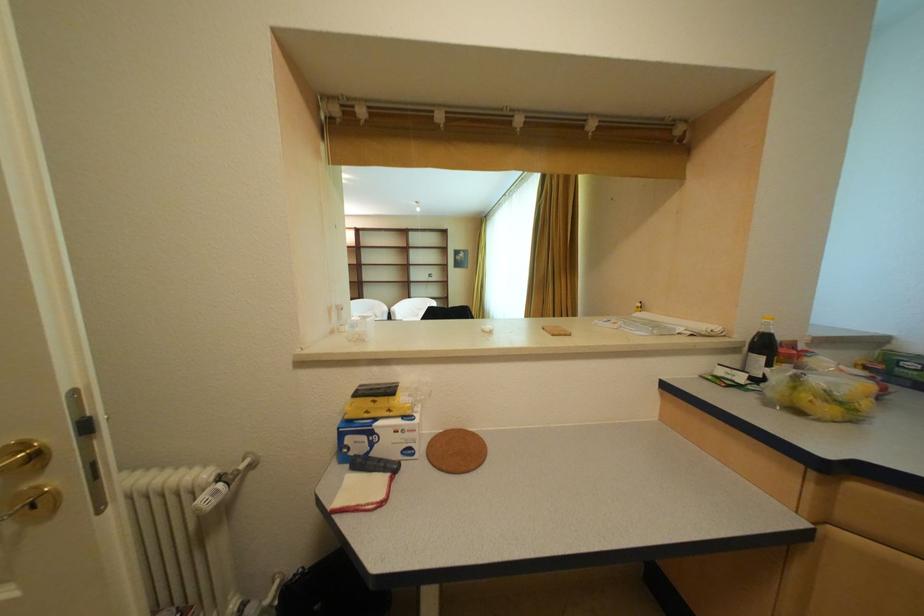
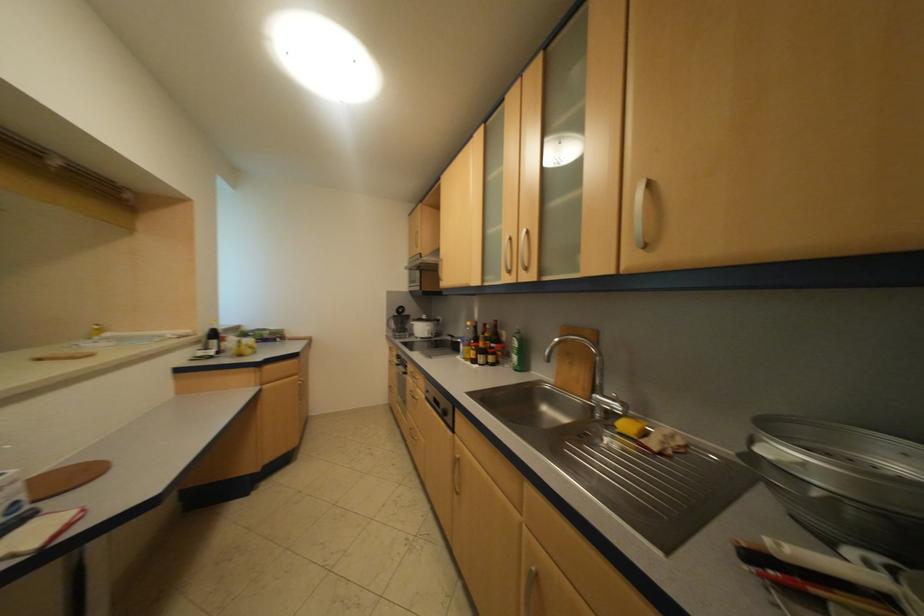
Find the pixel in the second image that matches [755,338] in the first image.

(214, 334)